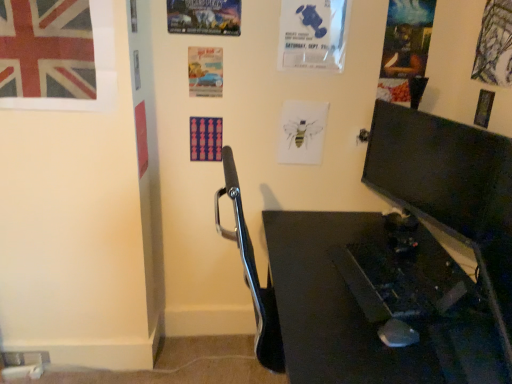
Where is `free space above black glossy desk at lower right (from a real-world perspective)`? The height and width of the screenshot is (384, 512). free space above black glossy desk at lower right (from a real-world perspective) is located at coordinates (393, 289).